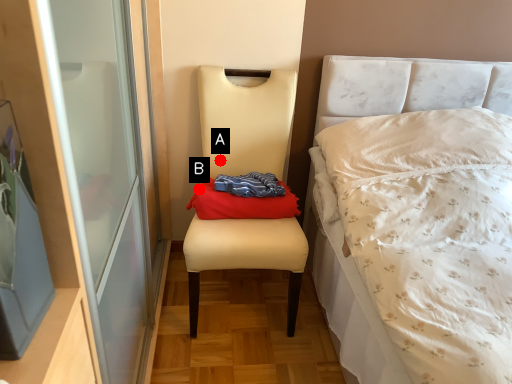
Question: Two points are circled on the image, labeled by A and B beside each circle. Among these points, which one is farthest from the camera?

Choices:
 (A) A is further
 (B) B is further

Answer: (A)